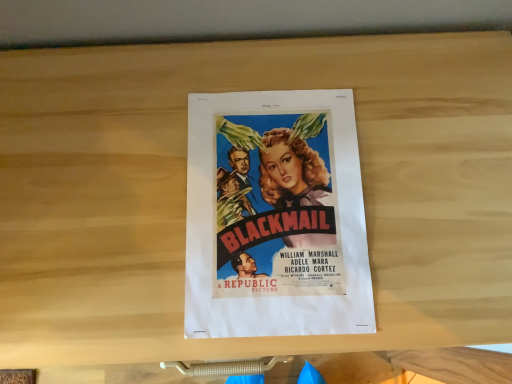
Find the location of `vacant space behind matte paper poster at center`. vacant space behind matte paper poster at center is located at coordinates (287, 68).